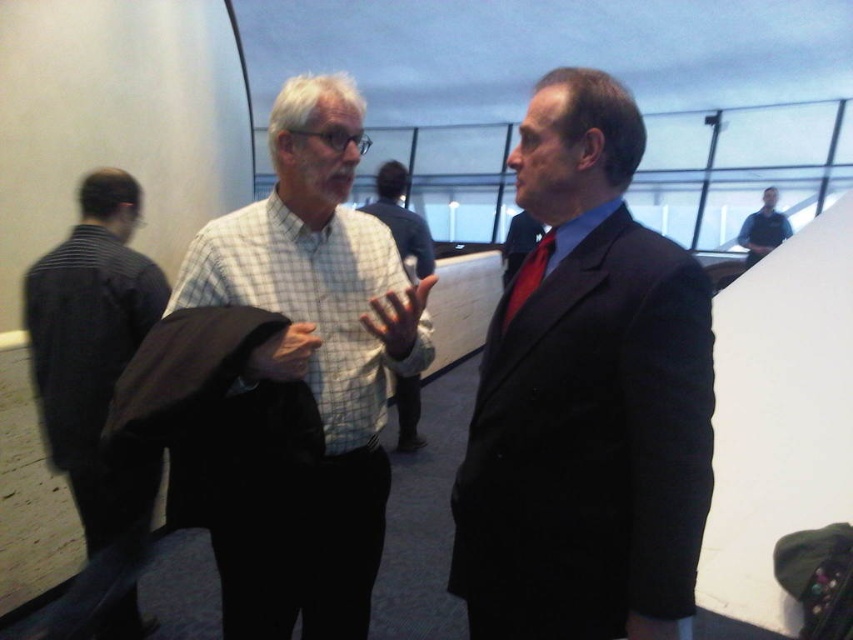
Question: Which point is closer to the camera?

Choices:
 (A) matte black suit at center
 (B) red satin tie at center
 (C) dark suit at center

Answer: (A)

Question: Which is farther from the white checkered shirt at center?

Choices:
 (A) dark suit at center
 (B) matte black suit at center
 (C) checkered fabric shirt at center
 (D) dark blue shirt at upper right

Answer: (D)

Question: Is striped fabric shirt at left bigger than red satin tie at center?

Choices:
 (A) yes
 (B) no

Answer: (A)

Question: Which object is the farthest from the dark blue shirt at upper right?

Choices:
 (A) checkered fabric shirt at center
 (B) red satin tie at center
 (C) dark suit at center

Answer: (B)

Question: Is striped fabric shirt at left smaller than dark blue shirt at upper right?

Choices:
 (A) no
 (B) yes

Answer: (A)

Question: Does striped fabric shirt at left appear on the left side of dark suit at center?

Choices:
 (A) yes
 (B) no

Answer: (A)